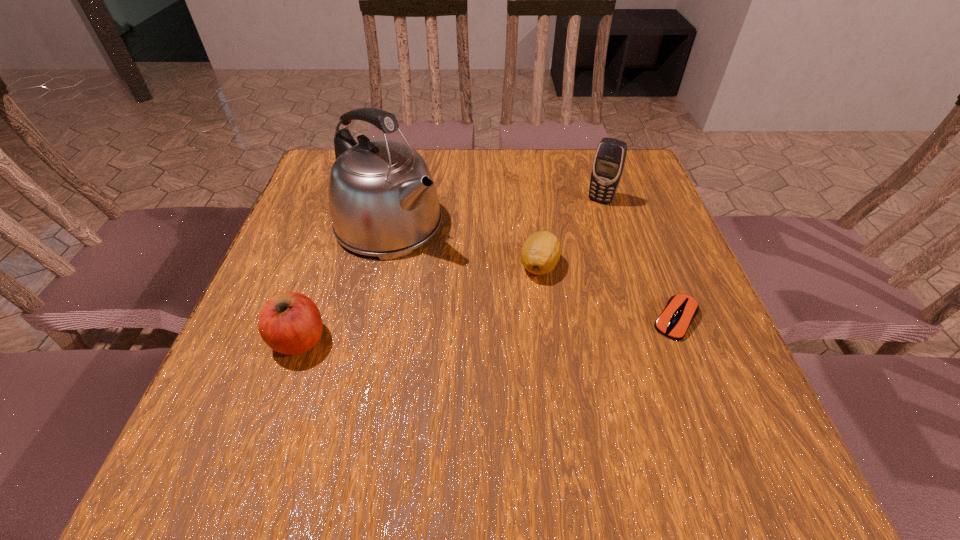
Where is `the third tallest object`? This screenshot has height=540, width=960. the third tallest object is located at coordinates (290, 323).

This screenshot has width=960, height=540. Find the location of `the shortest object`. the shortest object is located at coordinates [x=681, y=309].

This screenshot has height=540, width=960. Find the location of `the fourth tallest object`. the fourth tallest object is located at coordinates (540, 253).

This screenshot has height=540, width=960. Identify the location of the third object from left to right. (540, 253).

This screenshot has height=540, width=960. I want to click on the fourth shortest object, so click(x=609, y=161).

Image resolution: width=960 pixels, height=540 pixels. Identify the location of the tallest object. (383, 202).

The image size is (960, 540). In order to click on free spot located on the right of the third shortest object in this screenshot , I will do `click(420, 340)`.

Image resolution: width=960 pixels, height=540 pixels. I want to click on free space located 0.050m on the front of the shortest object, so click(693, 364).

At what (x,y) coordinates should I click in order to perform the action: click on free location located at the stem end of the lemon. Please return your answer as a coordinate pair (x, y). This screenshot has width=960, height=540. Looking at the image, I should click on (477, 325).

You are a GUI agent. You are given a task and a screenshot of the screen. Output one action in this format:
    pyautogui.click(x=<x>, y=<y>)
    Task: Click on the vacant space located at the stem end of the lemon
    This screenshot has height=540, width=960.
    Given the screenshot: What is the action you would take?
    pyautogui.click(x=417, y=380)